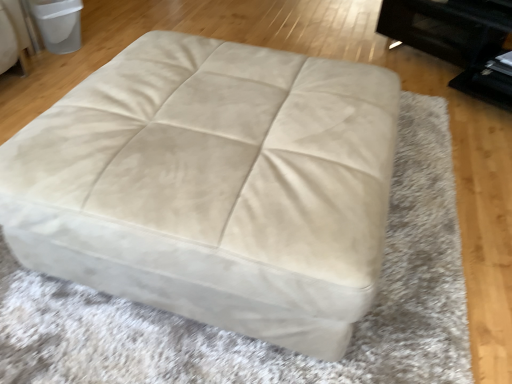
Question: Choose the correct answer: Is beige suede ottoman at center inside beige suede ottoman at upper left or outside it?

Choices:
 (A) outside
 (B) inside

Answer: (A)

Question: From the image's perspective, is beige suede ottoman at center above or below beige suede ottoman at upper left?

Choices:
 (A) below
 (B) above

Answer: (A)

Question: From a real-world perspective, relative to beige suede ottoman at upper left, is beige suede ottoman at center vertically above or below?

Choices:
 (A) above
 (B) below

Answer: (A)

Question: From a real-world perspective, is beige suede ottoman at upper left above or below beige suede ottoman at center?

Choices:
 (A) below
 (B) above

Answer: (A)

Question: Would you say beige suede ottoman at upper left is inside or outside beige suede ottoman at center?

Choices:
 (A) inside
 (B) outside

Answer: (B)

Question: Considering the positions of beige suede ottoman at upper left and beige suede ottoman at center in the image, is beige suede ottoman at upper left bigger or smaller than beige suede ottoman at center?

Choices:
 (A) small
 (B) big

Answer: (A)

Question: Is point (41, 13) closer or farther from the camera than point (282, 152)?

Choices:
 (A) closer
 (B) farther

Answer: (B)